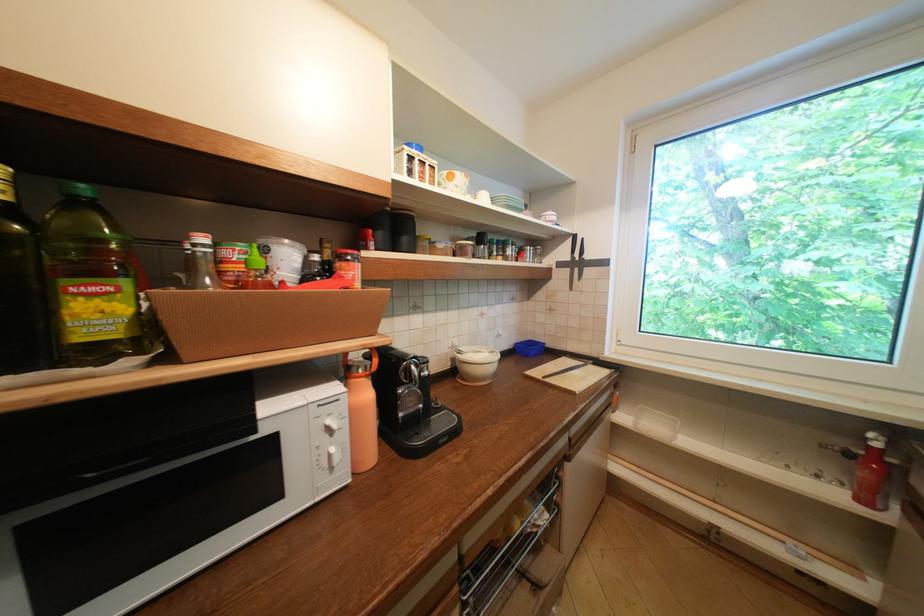
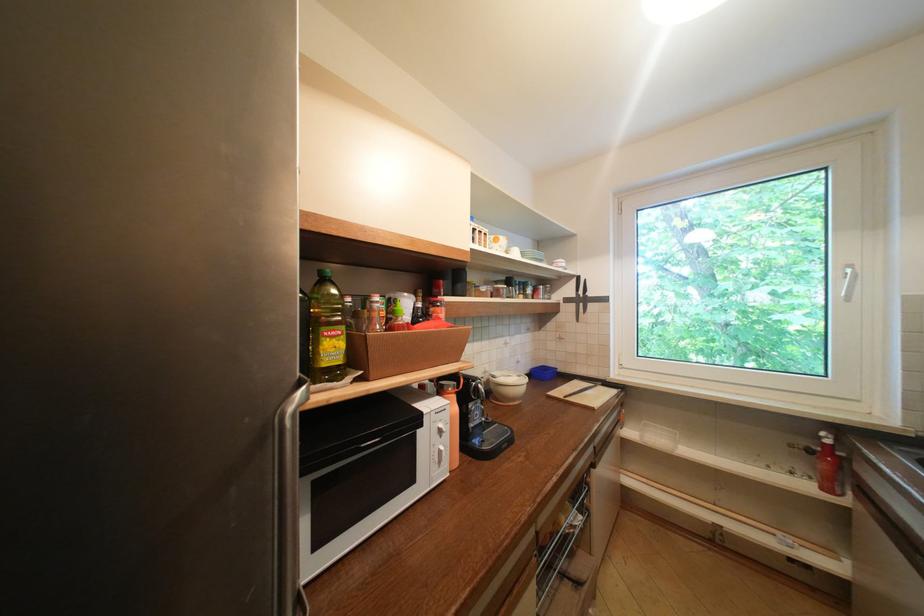
Find the pixel in the second image that matches (x=568, y=265) in the first image.

(575, 301)